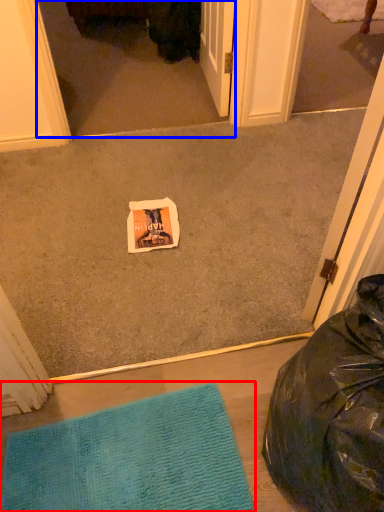
Question: Which of the following is the closest to the observer, mat (highlighted by a red box) or screen door (highlighted by a blue box)?

Choices:
 (A) mat
 (B) screen door

Answer: (A)